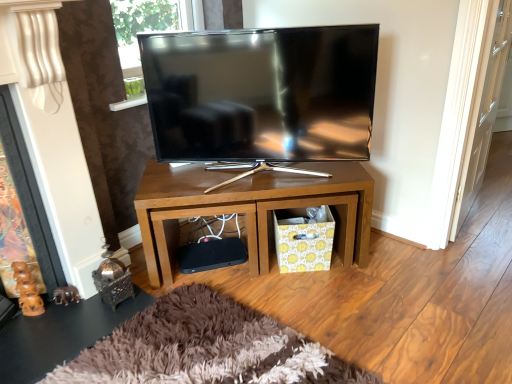
Question: Can you confirm if yellow floral cardboard crate at lower center is smaller than brown wood fireplace at left?

Choices:
 (A) yes
 (B) no

Answer: (A)

Question: Is brown wood fireplace at left completely or partially inside yellow floral cardboard crate at lower center?

Choices:
 (A) yes
 (B) no

Answer: (B)

Question: From a real-world perspective, is yellow floral cardboard crate at lower center located beneath brown wood fireplace at left?

Choices:
 (A) no
 (B) yes

Answer: (B)

Question: Can you confirm if yellow floral cardboard crate at lower center is wider than brown wood fireplace at left?

Choices:
 (A) no
 (B) yes

Answer: (A)

Question: From the image's perspective, is yellow floral cardboard crate at lower center over brown wood fireplace at left?

Choices:
 (A) yes
 (B) no

Answer: (B)

Question: Does yellow floral cardboard crate at lower center have a lesser width compared to brown wood fireplace at left?

Choices:
 (A) no
 (B) yes

Answer: (B)

Question: Can you confirm if matte black tv at center is wider than yellow floral cardboard crate at lower center?

Choices:
 (A) yes
 (B) no

Answer: (A)

Question: Does matte black tv at center have a greater height compared to yellow floral cardboard crate at lower center?

Choices:
 (A) yes
 (B) no

Answer: (A)

Question: From a real-world perspective, is matte black tv at center positioned over yellow floral cardboard crate at lower center based on gravity?

Choices:
 (A) yes
 (B) no

Answer: (A)

Question: From a real-world perspective, is matte black tv at center below yellow floral cardboard crate at lower center?

Choices:
 (A) no
 (B) yes

Answer: (A)

Question: Is matte black tv at center far from yellow floral cardboard crate at lower center?

Choices:
 (A) no
 (B) yes

Answer: (A)

Question: Can you confirm if matte black tv at center is shorter than yellow floral cardboard crate at lower center?

Choices:
 (A) no
 (B) yes

Answer: (A)

Question: Does matte black tv at center lie in front of wooden tv stand at center?

Choices:
 (A) no
 (B) yes

Answer: (B)